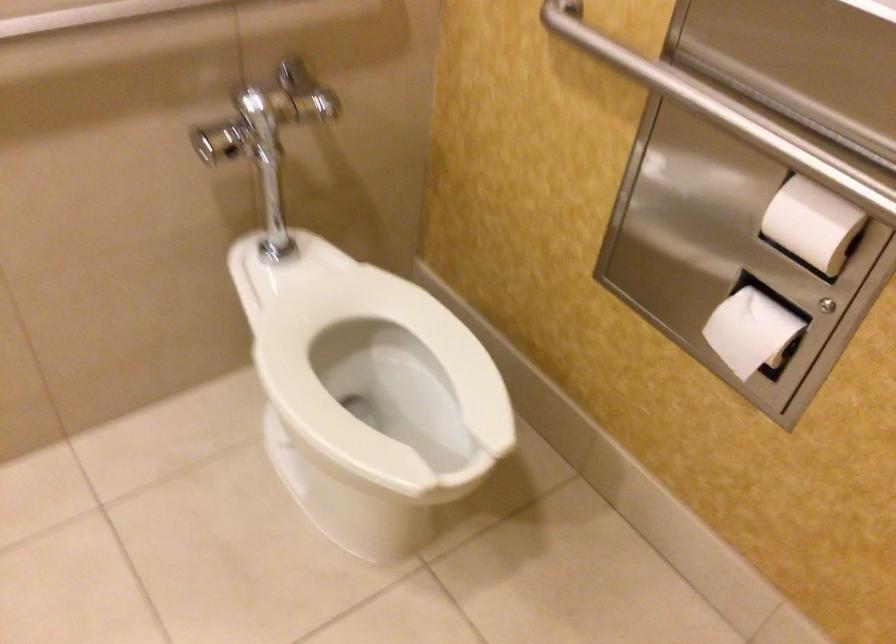
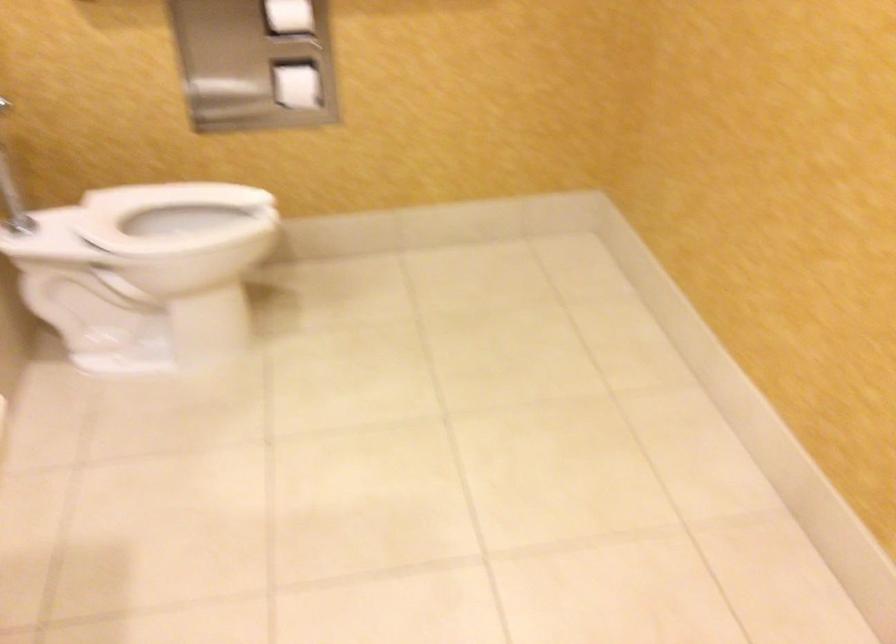
In the second image, find the point that corresponds to [442,355] in the first image.

(174, 216)